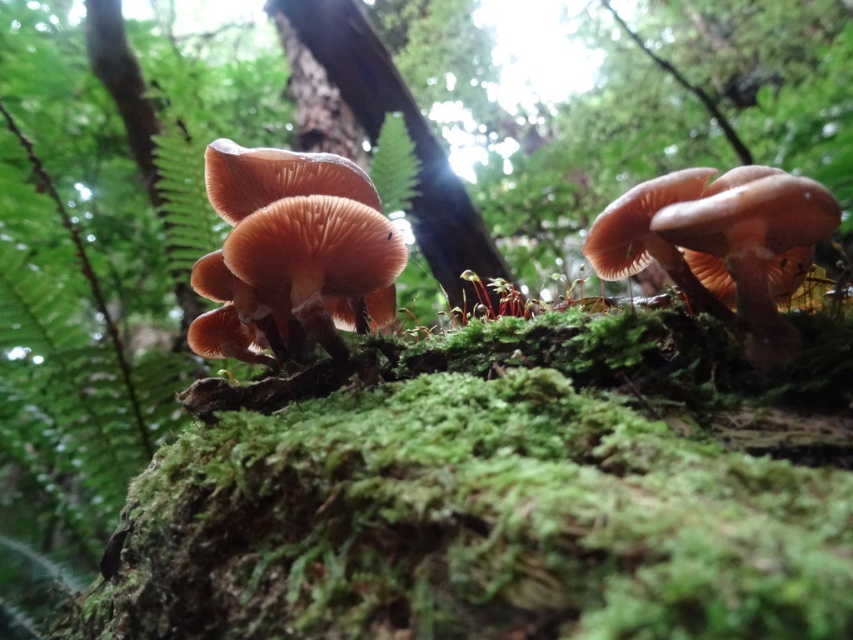
Is point (305, 266) closer to camera compared to point (444, 204)?

Yes, it is.

Is brown matte fungi at center below smooth brown tree trunk at center?

Correct, brown matte fungi at center is located below smooth brown tree trunk at center.

Find the location of a particular element. brown matte fungi at center is located at coordinates (292, 252).